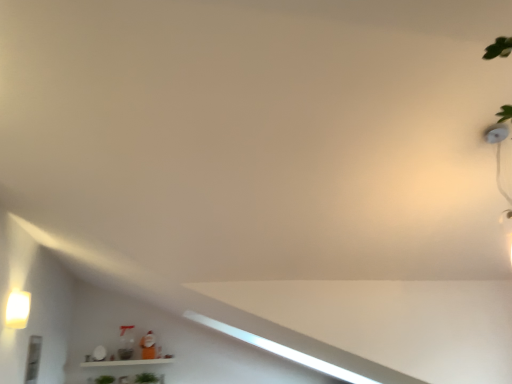
What do you see at coordinates (146, 378) in the screenshot? I see `green matte plant at lower center, which is the second plant from left to right` at bounding box center [146, 378].

The height and width of the screenshot is (384, 512). Describe the element at coordinates (18, 309) in the screenshot. I see `matte white light fixture at left` at that location.

Locate an element on the screen. The width and height of the screenshot is (512, 384). green matte plant at lower center, arranged as the first plant when viewed from the right is located at coordinates (146, 378).

Do you think green matte plant at lower center, arranged as the first plant when viewed from the right, is within matte white light fixture at left, or outside of it?

green matte plant at lower center, arranged as the first plant when viewed from the right, cannot be found inside matte white light fixture at left.

How different are the orientations of green matte plant at lower center, which is the second plant from left to right, and matte white light fixture at left in degrees?

89.4 degrees.

Is point (157, 380) positioned before point (8, 319)?

No, (157, 380) is further to viewer.

At what (x,y) coordinates should I click in order to perform the action: click on the 2nd plant to the right of the matte white light fixture at left, starting your count from the anchor. Please return your answer as a coordinate pair (x, y). This screenshot has height=384, width=512. Looking at the image, I should click on (146, 378).

Is point (112, 379) closer to viewer compared to point (9, 314)?

That is False.

How many degrees apart are the facing directions of green leafy plant at lower center, the 2th plant from the right, and matte white light fixture at left?

The angular difference between green leafy plant at lower center, the 2th plant from the right, and matte white light fixture at left is 87.7 degrees.

Which is correct: green leafy plant at lower center, the 2th plant from the right, is inside matte white light fixture at left, or outside of it?

green leafy plant at lower center, the 2th plant from the right, is not enclosed by matte white light fixture at left.

Is there a large distance between green leafy plant at lower center, which appears as the 1th plant when viewed from the left, and matte white light fixture at left?

That's right, there is a large distance between green leafy plant at lower center, which appears as the 1th plant when viewed from the left, and matte white light fixture at left.

Consider the image. Considering the positions of objects matte white light fixture at left and green matte plant at lower center, which is the second plant from left to right, in the image provided, who is in front, matte white light fixture at left or green matte plant at lower center, which is the second plant from left to right,?

matte white light fixture at left is closer to the camera.

From a real-world perspective, is matte white light fixture at left positioned above or below green matte plant at lower center, arranged as the first plant when viewed from the right?

From a real-world perspective, matte white light fixture at left is physically above green matte plant at lower center, arranged as the first plant when viewed from the right.

Considering the sizes of objects matte white light fixture at left and green matte plant at lower center, which is the second plant from left to right, in the image provided, who is thinner, matte white light fixture at left or green matte plant at lower center, which is the second plant from left to right,?

Thinner between the two is matte white light fixture at left.

Measure the distance between matte white light fixture at left and green matte plant at lower center, which is the second plant from left to right.

matte white light fixture at left is 2.93 meters from green matte plant at lower center, which is the second plant from left to right.

From a real-world perspective, is green matte plant at lower center, arranged as the first plant when viewed from the right, positioned above or below green leafy plant at lower center, which appears as the 1th plant when viewed from the left?

In terms of real-world spatial position, green matte plant at lower center, arranged as the first plant when viewed from the right, is above green leafy plant at lower center, which appears as the 1th plant when viewed from the left.

Could you tell me if green matte plant at lower center, which is the second plant from left to right, is turned towards green leafy plant at lower center, the 2th plant from the right?

No, green matte plant at lower center, which is the second plant from left to right, is not turned towards green leafy plant at lower center, the 2th plant from the right.

Based on the photo, which is correct: green matte plant at lower center, arranged as the first plant when viewed from the right, is inside green leafy plant at lower center, the 2th plant from the right, or outside of it?

green matte plant at lower center, arranged as the first plant when viewed from the right, exists outside the volume of green leafy plant at lower center, the 2th plant from the right.

Can you confirm if green matte plant at lower center, arranged as the first plant when viewed from the right, is taller than green leafy plant at lower center, the 2th plant from the right?

Indeed, green matte plant at lower center, arranged as the first plant when viewed from the right, has a greater height compared to green leafy plant at lower center, the 2th plant from the right.

From a real-world perspective, is matte white light fixture at left on green leafy plant at lower center, which appears as the 1th plant when viewed from the left?

Correct, in the physical world, matte white light fixture at left is higher than green leafy plant at lower center, which appears as the 1th plant when viewed from the left.

Is matte white light fixture at left taller than green leafy plant at lower center, which appears as the 1th plant when viewed from the left?

Yes, matte white light fixture at left is taller than green leafy plant at lower center, which appears as the 1th plant when viewed from the left.

Who is smaller, matte white light fixture at left or green leafy plant at lower center, the 2th plant from the right?

green leafy plant at lower center, the 2th plant from the right, is smaller.

Between green leafy plant at lower center, which appears as the 1th plant when viewed from the left, and green matte plant at lower center, arranged as the first plant when viewed from the right, which one has less height?

With less height is green leafy plant at lower center, which appears as the 1th plant when viewed from the left.

From a real-world perspective, which is physically above, green leafy plant at lower center, the 2th plant from the right, or green matte plant at lower center, which is the second plant from left to right?

green matte plant at lower center, which is the second plant from left to right, is physically above.

Is point (111, 382) behind point (153, 379)?

No, it is in front of (153, 379).

Could you tell me if green leafy plant at lower center, which appears as the 1th plant when viewed from the left, is turned towards green matte plant at lower center, arranged as the first plant when viewed from the right?

No.

Identify the location of light fixture above the green matte plant at lower center, which is the second plant from left to right (from the image's perspective). (18, 309).

The height and width of the screenshot is (384, 512). Identify the location of light fixture that appears above the green leafy plant at lower center, the 2th plant from the right (from a real-world perspective). (18, 309).

Looking at the image, which one is located further to green matte plant at lower center, arranged as the first plant when viewed from the right, green leafy plant at lower center, which appears as the 1th plant when viewed from the left, or matte white light fixture at left?

Based on the image, matte white light fixture at left appears to be further to green matte plant at lower center, arranged as the first plant when viewed from the right.

Looking at the image, which one is located closer to green leafy plant at lower center, which appears as the 1th plant when viewed from the left, green matte plant at lower center, which is the second plant from left to right, or matte white light fixture at left?

Based on the image, green matte plant at lower center, which is the second plant from left to right, appears to be nearer to green leafy plant at lower center, which appears as the 1th plant when viewed from the left.

Estimate the real-world distances between objects in this image. Which object is further from matte white light fixture at left, green leafy plant at lower center, which appears as the 1th plant when viewed from the left, or green matte plant at lower center, arranged as the first plant when viewed from the right?

Based on the image, green matte plant at lower center, arranged as the first plant when viewed from the right, appears to be further to matte white light fixture at left.

Looking at the image, which one is located closer to matte white light fixture at left, green matte plant at lower center, arranged as the first plant when viewed from the right, or green leafy plant at lower center, the 2th plant from the right?

Among the two, green leafy plant at lower center, the 2th plant from the right, is located nearer to matte white light fixture at left.

Considering their positions, is matte white light fixture at left positioned further to green leafy plant at lower center, the 2th plant from the right, than green matte plant at lower center, which is the second plant from left to right?

matte white light fixture at left.

Based on their spatial positions, is matte white light fixture at left or green leafy plant at lower center, the 2th plant from the right, closer to green matte plant at lower center, which is the second plant from left to right?

green leafy plant at lower center, the 2th plant from the right.

I want to click on plant located between matte white light fixture at left and green matte plant at lower center, arranged as the first plant when viewed from the right, in the depth direction, so click(105, 379).